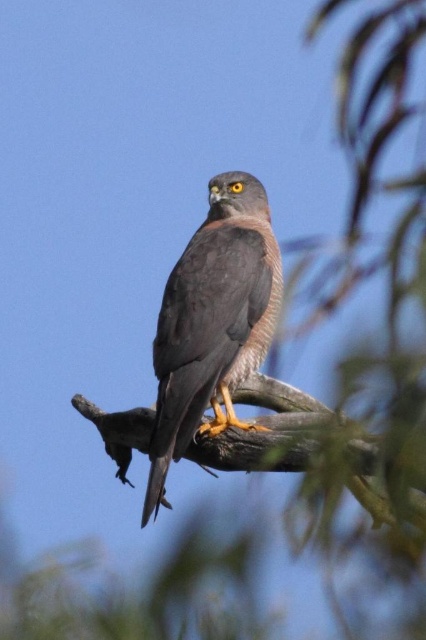
You are a birdwatcher holding a ruler. You see the dark gray feathers at center and the smooth gray wood at center in the image. How far apart are these two objects?

The dark gray feathers at center and the smooth gray wood at center are 9.94 inches apart.

You are an ornithologist observing a hawk in a tree. You notice the dark gray feathers at center and the smooth gray wood at center. Which object takes up more space in the image?

Answer: The smooth gray wood at center takes up more space in the image because the dark gray feathers at center has a smaller size compared to it.

You are an artist trying to sketch the scene. You notice two elements at the center of your viewfinder. Which one is narrower between the dark gray feathers at center and the smooth gray wood at center?

The dark gray feathers at center has a lesser width compared to smooth gray wood at center, so the dark gray feathers at center is narrower.